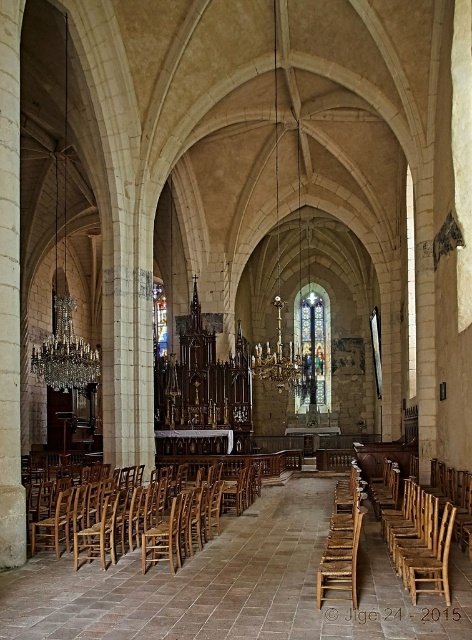
Is rustic wood chair at right above worn wood chair at center?

Incorrect, rustic wood chair at right is not positioned above worn wood chair at center.

Identify the location of rustic wood chair at right. This screenshot has width=472, height=640. (396, 529).

Between point (388, 544) and point (317, 582), which one is positioned behind?

Point (388, 544)

At what (x,y) coordinates should I click in order to perform the action: click on rustic wood chair at right. Please return your answer as a coordinate pair (x, y). Image resolution: width=472 pixels, height=640 pixels. Looking at the image, I should click on (396, 529).

Who is positioned more to the right, wooden chair at left or worn wood chair at center?

worn wood chair at center

Locate an element on the screen. wooden chair at left is located at coordinates (151, 506).

Does point (138, 492) come in front of point (356, 529)?

No, (138, 492) is behind (356, 529).

Identify the location of wooden chair at left. (151, 506).

Who is lower down, wooden chair at left or rustic wood chair at right?

wooden chair at left

In the scene shown: Is the position of wooden chair at left less distant than that of rustic wood chair at right?

That is False.

Locate an element on the screen. This screenshot has width=472, height=640. wooden chair at left is located at coordinates (151, 506).

Locate an element on the screen. This screenshot has width=472, height=640. wooden chair at left is located at coordinates (151, 506).